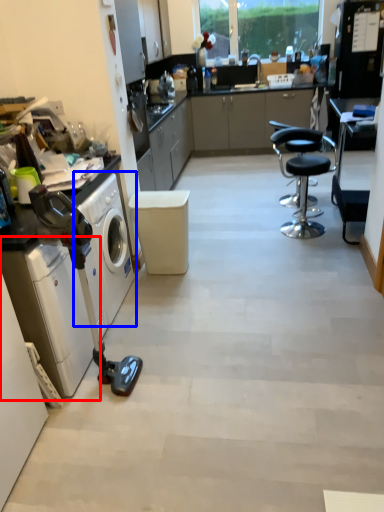
Question: Which of the following is the closest to the observer, washing machine (highlighted by a red box) or washing machine (highlighted by a blue box)?

Choices:
 (A) washing machine
 (B) washing machine

Answer: (A)